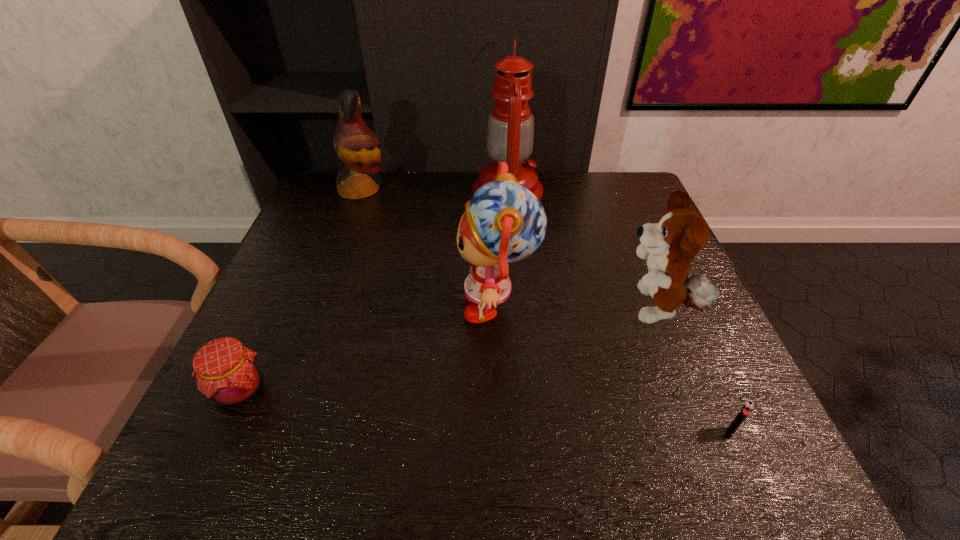
The height and width of the screenshot is (540, 960). Identify the location of vacant space situated 0.310m on the face of the doll. (314, 305).

You are a GUI agent. You are given a task and a screenshot of the screen. Output one action in this format:
    pyautogui.click(x=<x>, y=<y>)
    Task: Click on the vacant space located on the face of the doll
    This screenshot has height=540, width=960.
    Given the screenshot: What is the action you would take?
    pyautogui.click(x=309, y=305)

I want to click on free space located on the face of the doll, so click(280, 305).

Identify the location of vacant space situated on the face of the puppy. (578, 310).

Identify the location of free space located on the face of the puppy. The height and width of the screenshot is (540, 960). (x=502, y=310).

At what (x,y) coordinates should I click in order to perform the action: click on vacant area situated 0.380m on the face of the puppy. Please return your answer as a coordinate pair (x, y). The image size is (960, 540). Looking at the image, I should click on (436, 310).

Locate an element on the screen. The image size is (960, 540). vacant area situated 0.060m on the front of the jam is located at coordinates pos(213,450).

Locate an element on the screen. The image size is (960, 540). vacant region located 0.290m on the back of the shortest object is located at coordinates (671, 301).

Identify the location of oil lamp positioned at the far edge. (510, 130).

I want to click on parrot located at the far edge, so click(356, 145).